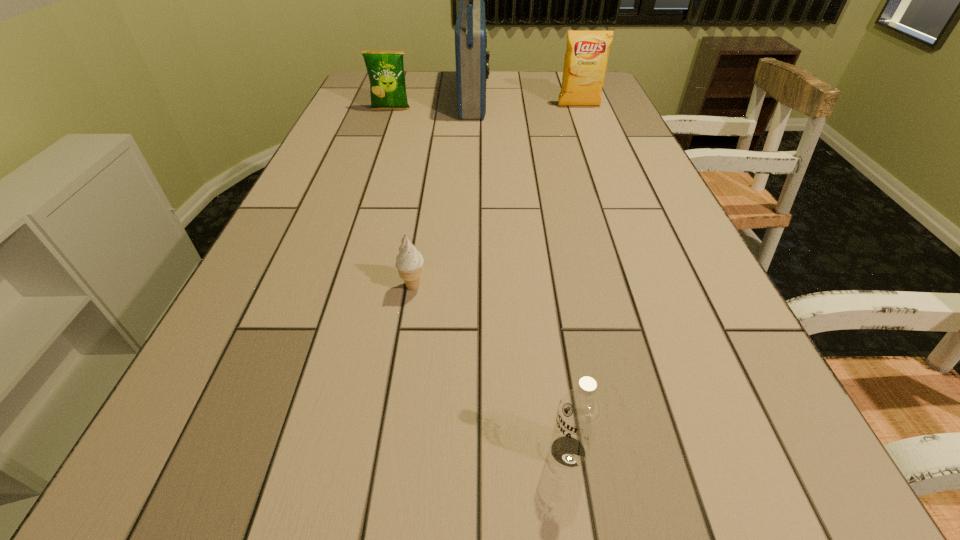
The image size is (960, 540). I want to click on the tallest object, so click(x=472, y=60).

Locate an element on the screen. the third object from left to right is located at coordinates (472, 60).

Locate an element on the screen. The image size is (960, 540). the right crisp (potato chip) is located at coordinates (586, 58).

The height and width of the screenshot is (540, 960). I want to click on the rightmost object, so click(586, 58).

Where is `the shorter crisp (potato chip)`? the shorter crisp (potato chip) is located at coordinates (385, 69).

Find the location of a particular element. The height and width of the screenshot is (540, 960). the leftmost object is located at coordinates (385, 69).

You are a GUI agent. You are given a task and a screenshot of the screen. Output one action in this format:
    pyautogui.click(x=<x>, y=<y>)
    Task: Click on the second object from right to left
    
    Given the screenshot: What is the action you would take?
    pyautogui.click(x=579, y=413)

Locate an element on the screen. The image size is (960, 540). vodka is located at coordinates (579, 413).

The image size is (960, 540). I want to click on the second nearest object, so click(409, 262).

Locate an element on the screen. The image size is (960, 540). icecream is located at coordinates (409, 262).